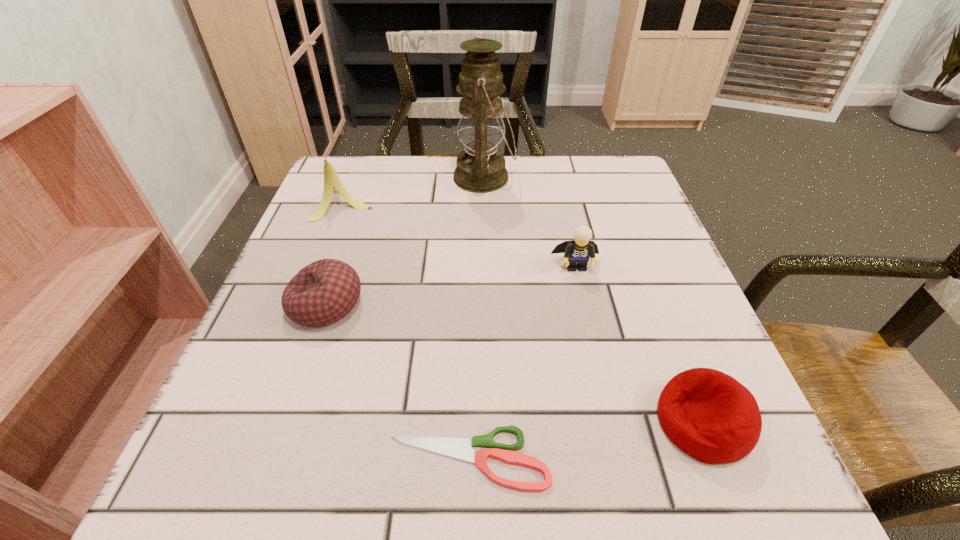
Image resolution: width=960 pixels, height=540 pixels. Identify the location of free point between the nearer beanbag and the third farthest object. (639, 344).

Find the location of a particular element. free space between the banana and the nearer beanbag is located at coordinates pos(524,312).

You are a GUI agent. You are given a task and a screenshot of the screen. Output one action in this format:
    pyautogui.click(x=<x>, y=<y>)
    Task: Click on the unoccupied area between the third tallest object and the rightmost object
    The width and height of the screenshot is (960, 540).
    Given the screenshot: What is the action you would take?
    pyautogui.click(x=639, y=344)

Where is `free space that is in between the fourth shortest object and the nearer beanbag`? free space that is in between the fourth shortest object and the nearer beanbag is located at coordinates (639, 344).

Identify which object is located as the third nearest to the tallest object. Please provide its 2D coordinates. Your answer should be formatted as a tuple, i.e. [(x, y)], where the tuple contains the x and y coordinates of a point satisfying the conditions above.

[(325, 291)]

Choose which object is the second nearest neighbor to the farther beanbag. Please provide its 2D coordinates. Your answer should be formatted as a tuple, i.e. [(x, y)], where the tuple contains the x and y coordinates of a point satisfying the conditions above.

[(461, 449)]

Image resolution: width=960 pixels, height=540 pixels. Find the location of `vacant area that satisfies the following two spatial constraints: 1. on the seat area of the nearer beanbag; 2. on the front side of the shortest object`. vacant area that satisfies the following two spatial constraints: 1. on the seat area of the nearer beanbag; 2. on the front side of the shortest object is located at coordinates (717, 459).

I want to click on vacant space that satisfies the following two spatial constraints: 1. on the back side of the shortest object; 2. on the right side of the tallest object, so click(474, 178).

You are a GUI agent. You are given a task and a screenshot of the screen. Output one action in this format:
    pyautogui.click(x=<x>, y=<y>)
    Task: Click on the free space that satisfies the following two spatial constraints: 1. on the back side of the tallest object; 2. on the left side of the left beanbag
    This screenshot has width=960, height=540.
    Given the screenshot: What is the action you would take?
    pyautogui.click(x=369, y=178)